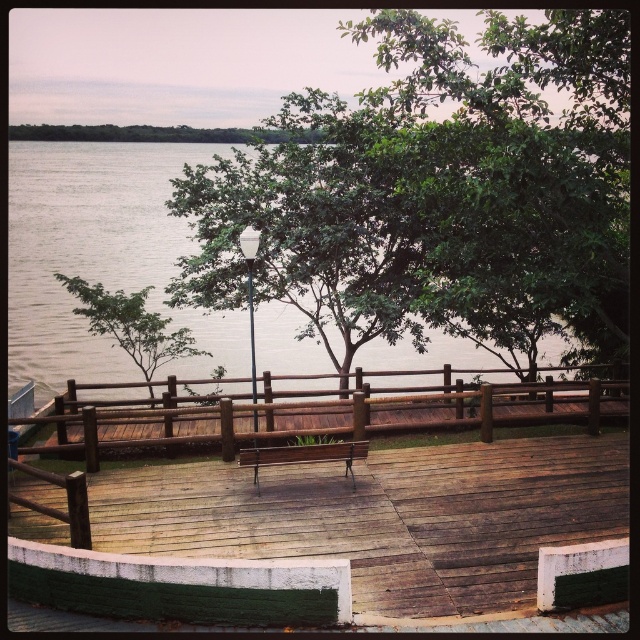
Based on the photo, you are standing on the wooden deck and want to sit on the bench while facing the river. If you look to your left, which object will you see first, the brown wooden rail at center or the green leafy tree at left?

The green leafy tree at left will be seen first because it is positioned to the left of the brown wooden rail at center.

You are standing at point [76,292] and want to walk to point [497,516]. Based on the scene description, can you directly walk towards your destination without any obstacles?

Point [497,516] is in front of point [76,292], so yes you can directly walk towards your destination without any obstacles.

You are standing on the wooden deck and see the wooden at center and the green leafy tree at left. Which object is closer to the river?

The green leafy tree at left is closer to the river because the wooden at center is positioned on the right side of it, meaning the tree is between the wooden object and the river.